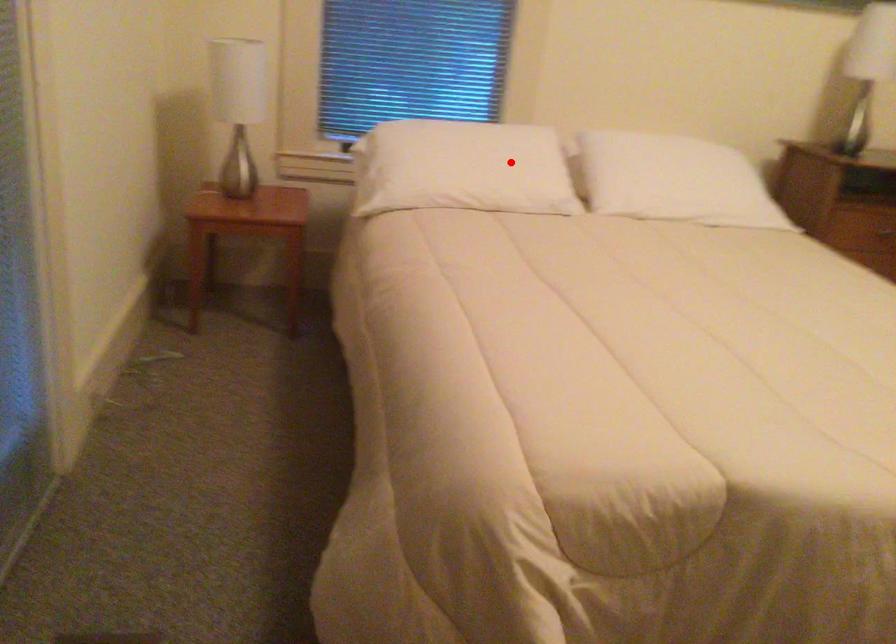
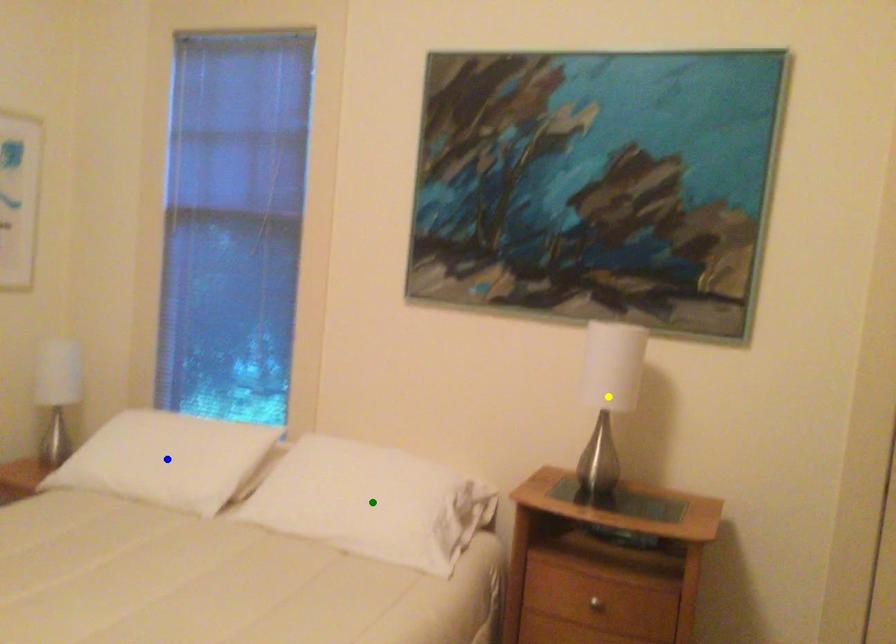
Question: I am providing you with two images of the same scene from different viewpoints. A red point is marked on the first image. You are given multiple points on the second image. In image 2, which mark is for the same physical point as the one in image 1?

Choices:
 (A) green point
 (B) yellow point
 (C) blue point

Answer: (C)